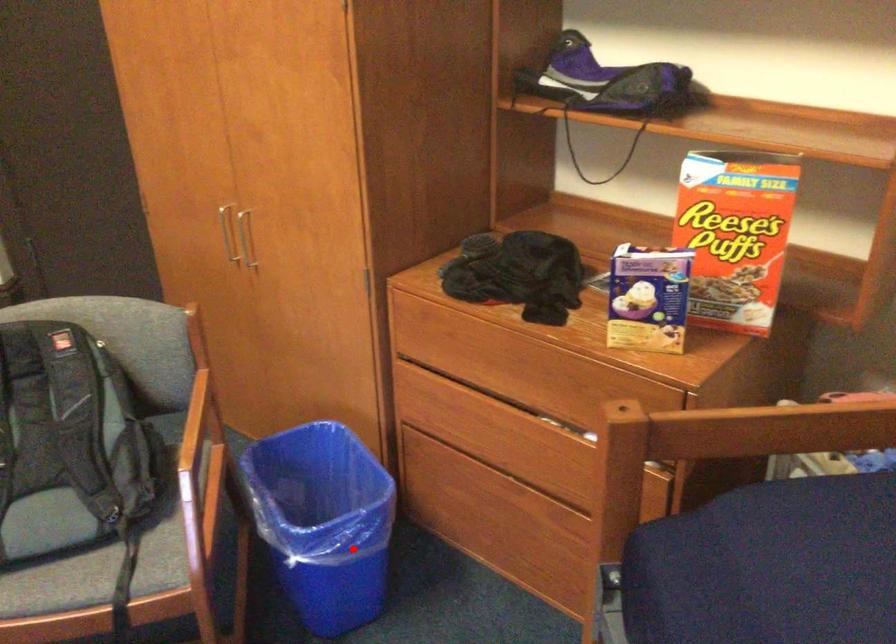
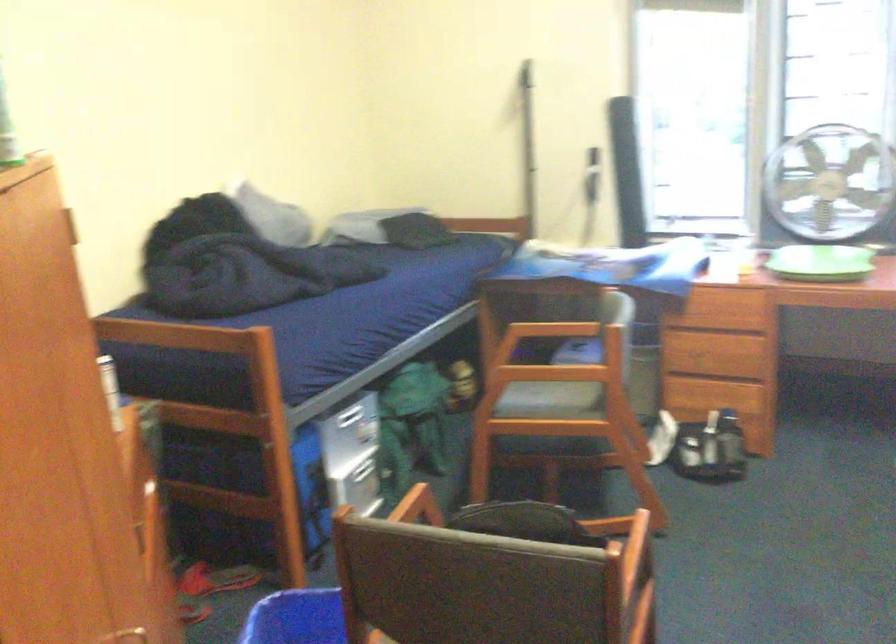
Question: I am providing you with two images of the same scene from different viewpoints. A red point is marked on the first image. Can you still see the location of the red point in image 2?

Choices:
 (A) Yes
 (B) No

Answer: (A)